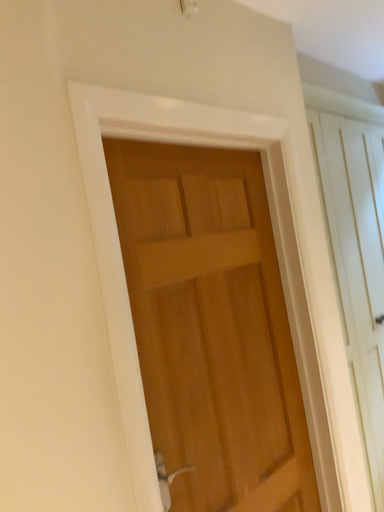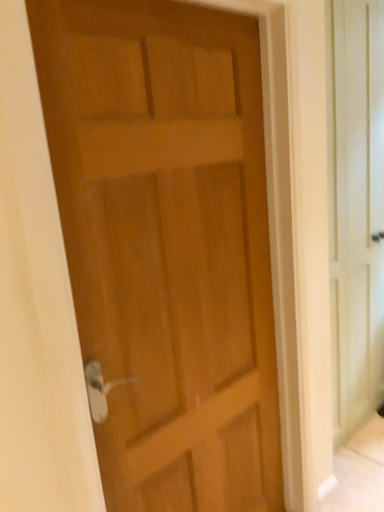
Question: How did the camera likely rotate when shooting the video?

Choices:
 (A) rotated upward
 (B) rotated downward

Answer: (B)